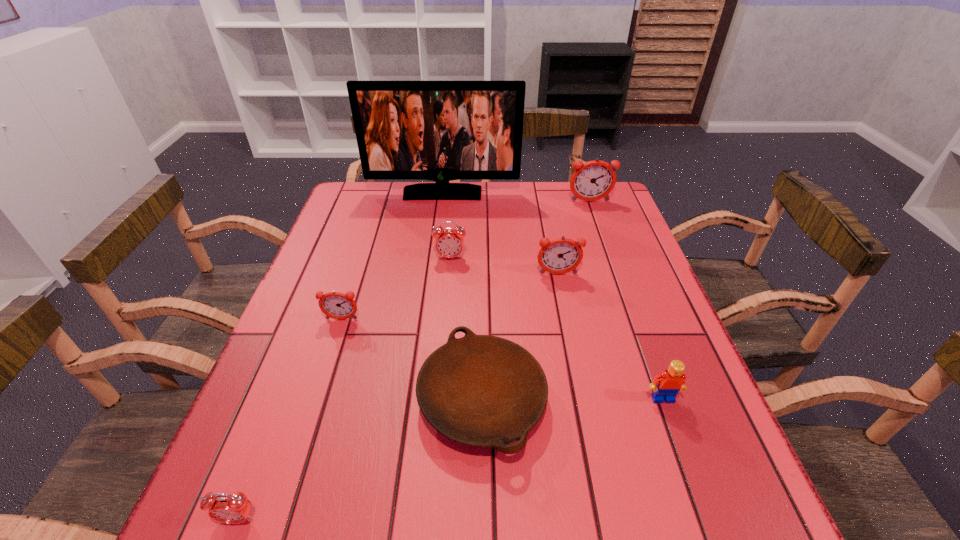
I want to click on the tallest object, so click(441, 131).

Locate an element on the screen. This screenshot has height=540, width=960. the farthest reddish-pink alarm clock is located at coordinates (593, 180).

I want to click on the rightmost reddish-pink alarm clock, so click(x=593, y=180).

The height and width of the screenshot is (540, 960). Identify the location of the third farthest alarm clock. (559, 256).

Identify the location of the second biggest reddish-pink alarm clock. (559, 256).

Image resolution: width=960 pixels, height=540 pixels. I want to click on the fourth nearest alarm clock, so click(449, 243).

Where is `the sixth nearest object`? The image size is (960, 540). the sixth nearest object is located at coordinates (449, 243).

This screenshot has height=540, width=960. Identify the location of Lego. (671, 381).

I want to click on the fourth farthest alarm clock, so click(x=336, y=305).

Locate an element on the screen. The image size is (960, 540). the leftmost reddish-pink alarm clock is located at coordinates (336, 305).